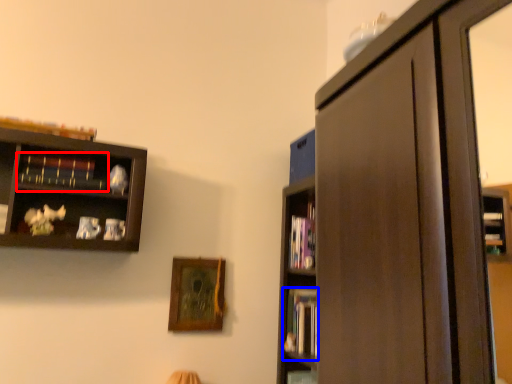
Question: Which of the following is the closest to the observer, book (highlighted by a red box) or book (highlighted by a blue box)?

Choices:
 (A) book
 (B) book

Answer: (A)